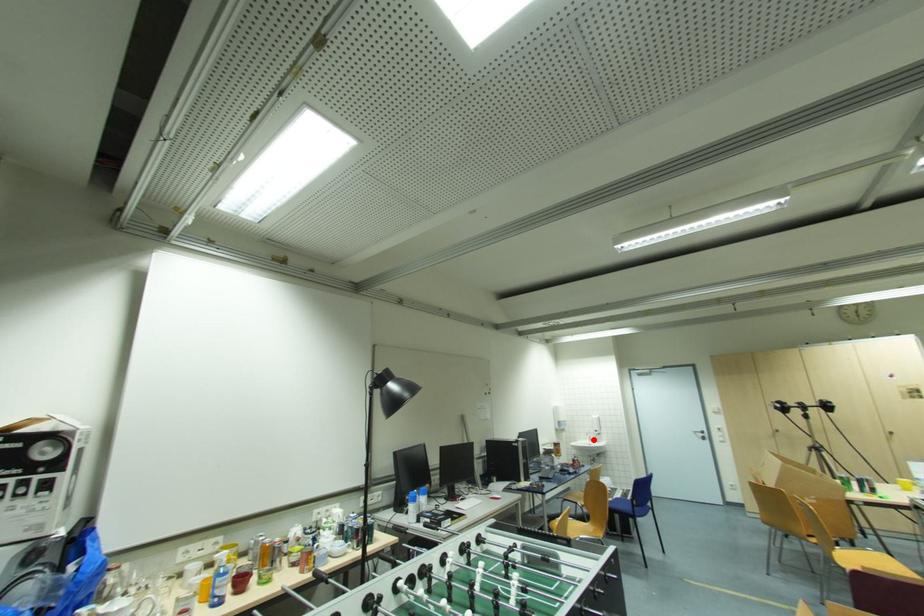
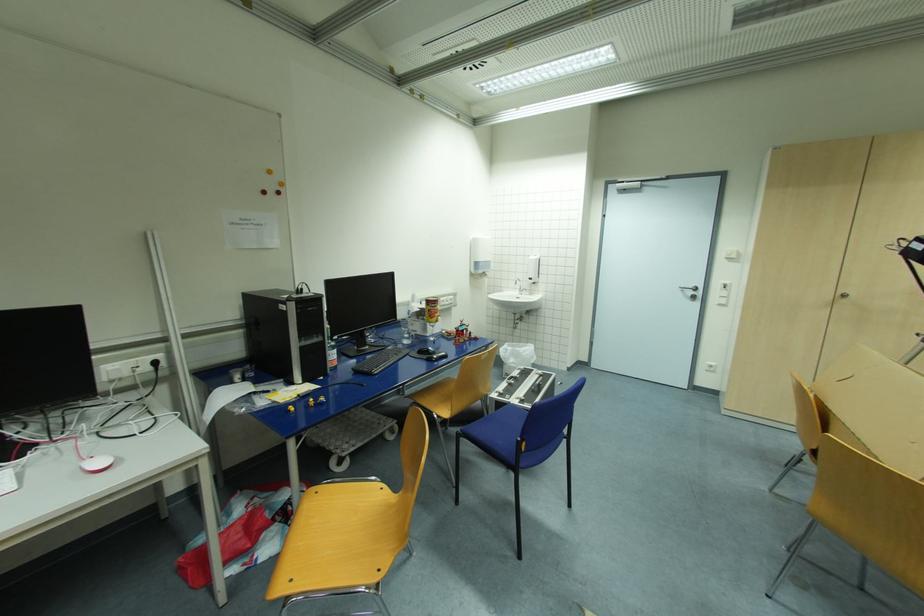
The point at the highlighted location is marked in the first image. Where is the corresponding point in the second image?

(525, 291)